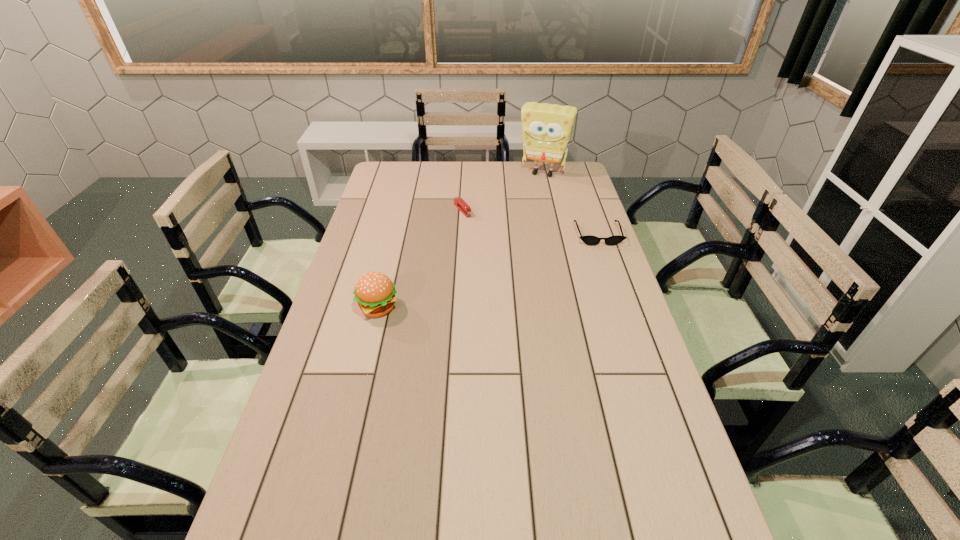
Find the location of a particular element. The image size is (960, 540). empty space between the third nearest object and the sponge is located at coordinates (503, 192).

You are a GUI agent. You are given a task and a screenshot of the screen. Output one action in this format:
    pyautogui.click(x=<x>, y=<y>)
    Task: Click on the vacant space that is in between the sunglasses and the leftmost object
    
    Given the screenshot: What is the action you would take?
    pyautogui.click(x=488, y=271)

Find the location of a particular element. The image size is (960, 540). empty space that is in between the second object from left to right and the third farthest object is located at coordinates (530, 222).

At what (x,y) coordinates should I click in order to perform the action: click on empty location between the third shortest object and the second object from left to right. Please return your answer as a coordinate pair (x, y). The image size is (960, 540). Looking at the image, I should click on (420, 259).

This screenshot has width=960, height=540. What are the coordinates of `free point between the third farthest object and the third shortest object` in the screenshot? It's located at (x=488, y=271).

Locate an element on the screen. Image resolution: width=960 pixels, height=540 pixels. free spot between the farthest object and the second farthest object is located at coordinates (503, 192).

Locate an element on the screen. vacant point located between the third farthest object and the leftmost object is located at coordinates (488, 271).

This screenshot has width=960, height=540. What are the coordinates of `object that is the second closest one to the farthest object` in the screenshot? It's located at (590, 240).

Locate which object is the closest to the third nearest object. Please provide its 2D coordinates. Your answer should be formatted as a tuple, i.e. [(x, y)], where the tuple contains the x and y coordinates of a point satisfying the conditions above.

[(547, 128)]